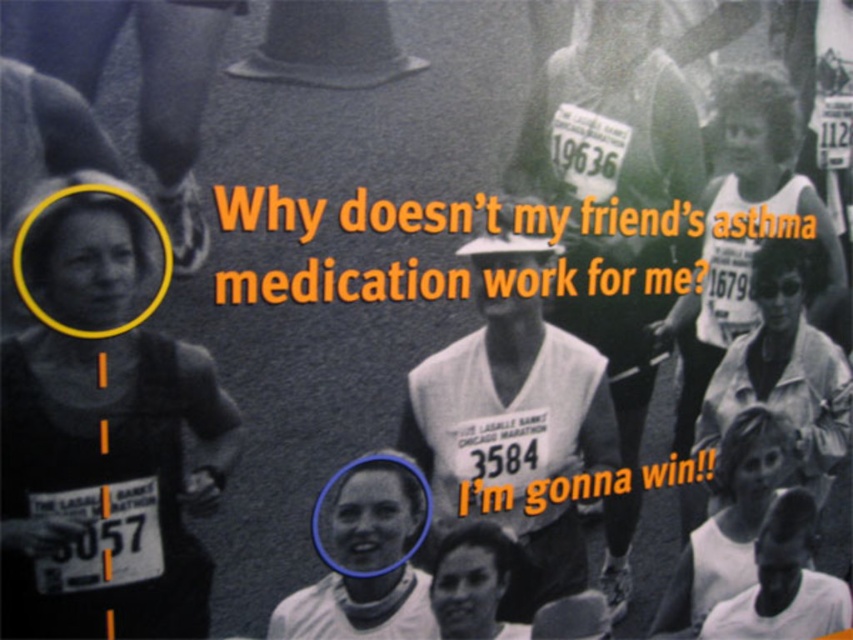
Measure the distance between white matte tank top at lower right and smooth white tank top at center.

white matte tank top at lower right and smooth white tank top at center are 26.10 inches apart.

Who is higher up, white matte tank top at lower right or smooth white tank top at center?

smooth white tank top at center is above.

Describe the element at coordinates (749, 541) in the screenshot. I see `white matte tank top at lower right` at that location.

Identify the location of white matte tank top at lower right. (749, 541).

Who is positioned more to the right, matte black shirt at left or white matte tank top at lower right?

white matte tank top at lower right

What do you see at coordinates (107, 483) in the screenshot?
I see `matte black shirt at left` at bounding box center [107, 483].

Between point (190, 508) and point (798, 499), which one is positioned behind?

The point (798, 499) is behind.

You are a GUI agent. You are given a task and a screenshot of the screen. Output one action in this format:
    pyautogui.click(x=<x>, y=<y>)
    Task: Click on the matte black shirt at left
    This screenshot has height=640, width=853.
    Given the screenshot: What is the action you would take?
    pyautogui.click(x=107, y=483)

The height and width of the screenshot is (640, 853). I want to click on matte black shirt at left, so click(x=107, y=483).

Which of these two, matte black shirt at left or smooth white tank top at center, stands taller?

matte black shirt at left

Find the location of a particular element. The height and width of the screenshot is (640, 853). matte black shirt at left is located at coordinates (107, 483).

Image resolution: width=853 pixels, height=640 pixels. I want to click on matte black shirt at left, so click(107, 483).